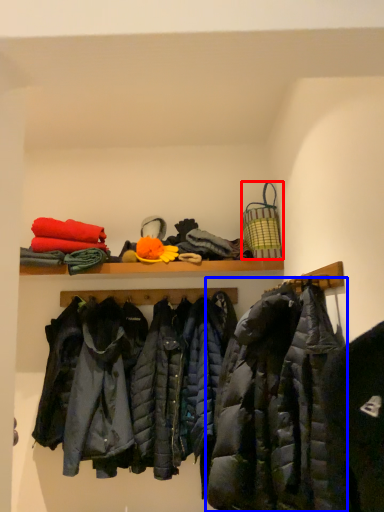
Question: Which object appears farthest to the camera in this image, basket (highlighted by a red box) or jacket (highlighted by a blue box)?

Choices:
 (A) basket
 (B) jacket

Answer: (A)